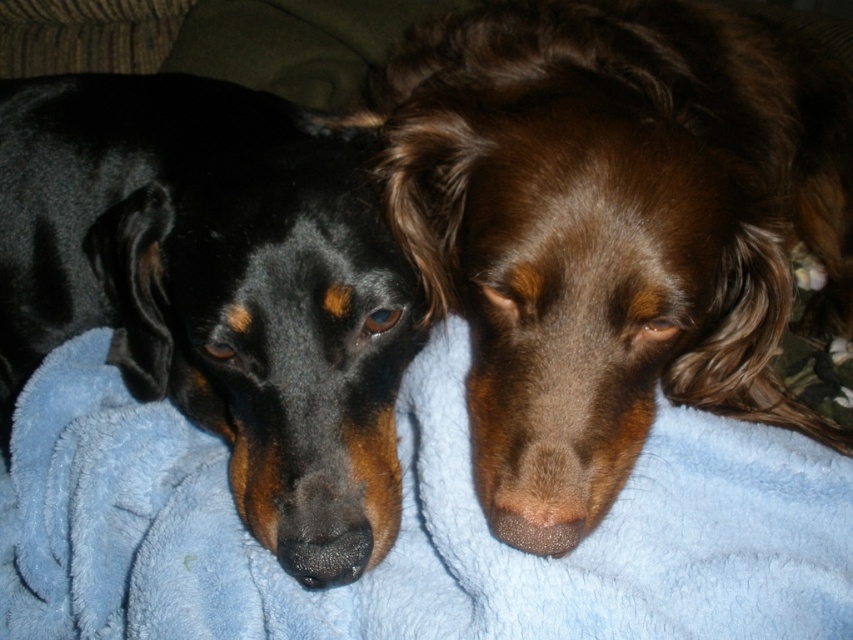
Does brown furry dog at center appear on the right side of blue fleece blanket at center?

Yes, brown furry dog at center is to the right of blue fleece blanket at center.

Who is shorter, brown furry dog at center or blue fleece blanket at center?

Standing shorter between the two is blue fleece blanket at center.

Who is more distant from viewer, (496, 1) or (51, 552)?

Positioned behind is point (496, 1).

Find the location of a particular element. brown furry dog at center is located at coordinates (614, 228).

Is point (172, 408) positioned in front of point (398, 506)?

No, (172, 408) is behind (398, 506).

Between point (152, 433) and point (178, 189), which one is positioned behind?

Positioned behind is point (152, 433).

This screenshot has height=640, width=853. In order to click on blue fleece blanket at center in this screenshot , I will do point(408,529).

Between brown furry dog at center and black fur dog at left, which one is positioned higher?

Positioned higher is brown furry dog at center.

Can you confirm if brown furry dog at center is taller than black fur dog at left?

Indeed, brown furry dog at center has a greater height compared to black fur dog at left.

Between point (711, 236) and point (9, 282), which one is positioned in front?

Point (711, 236) is more forward.

Locate an element on the screen. brown furry dog at center is located at coordinates (614, 228).